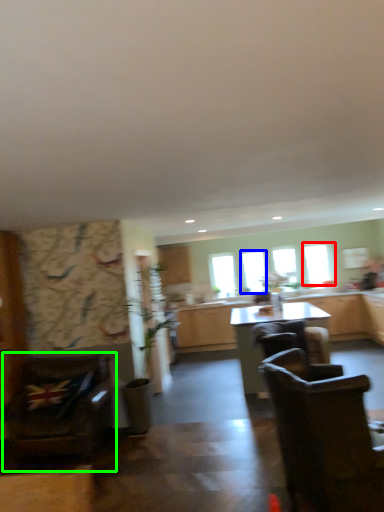
Question: Based on their relative distances, which object is farther from window (highlighted by a red box)? Choose from window (highlighted by a blue box) and chair (highlighted by a green box).

Choices:
 (A) window
 (B) chair

Answer: (B)